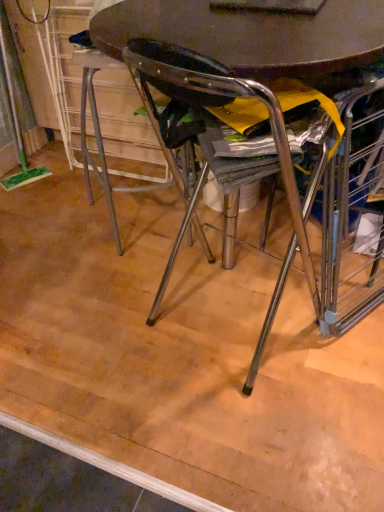
What is the approximate height of metallic brown table at center?

metallic brown table at center is 37.37 inches tall.

Identify the location of metallic brown table at center. (251, 35).

What do you see at coordinates (251, 35) in the screenshot? I see `metallic brown table at center` at bounding box center [251, 35].

This screenshot has width=384, height=512. What do you see at coordinates (180, 359) in the screenshot?
I see `matte wood floor at center` at bounding box center [180, 359].

Find the location of a particular element. matte wood floor at center is located at coordinates (180, 359).

Find the location of `metallic brown table at center`. metallic brown table at center is located at coordinates (251, 35).

Considering the positions of objects metallic brown table at center and matte wood floor at center in the image provided, who is more to the right, metallic brown table at center or matte wood floor at center?

Positioned to the right is metallic brown table at center.

In the image, is metallic brown table at center positioned in front of or behind matte wood floor at center?

Visually, metallic brown table at center is located in front of matte wood floor at center.

Does point (123, 29) come in front of point (246, 337)?

That is True.

Based on the photo, from the image's perspective, is metallic brown table at center on matte wood floor at center?

Indeed, from the image's perspective, metallic brown table at center is shown above matte wood floor at center.

From a real-world perspective, who is located lower, metallic brown table at center or matte wood floor at center?

matte wood floor at center is physically lower.

Which object is wider, metallic brown table at center or matte wood floor at center?

With larger width is matte wood floor at center.

Which of these two, metallic brown table at center or matte wood floor at center, stands taller?

metallic brown table at center is taller.

Considering the relative sizes of metallic brown table at center and matte wood floor at center in the image provided, is metallic brown table at center bigger than matte wood floor at center?

Yes, metallic brown table at center is bigger than matte wood floor at center.

Consider the image. Would you say metallic brown table at center is outside matte wood floor at center?

Yes, metallic brown table at center is located beyond the bounds of matte wood floor at center.

Is metallic brown table at center positioned far away from matte wood floor at center?

No, metallic brown table at center is in close proximity to matte wood floor at center.

Is metallic brown table at center facing towards matte wood floor at center?

No, metallic brown table at center is not facing towards matte wood floor at center.

Measure the distance from metallic brown table at center to matte wood floor at center.

metallic brown table at center is 35.10 inches from matte wood floor at center.

Find the location of a particular element. The width and height of the screenshot is (384, 512). plywood that is below the metallic brown table at center (from the image's perspective) is located at coordinates (180, 359).

Does matte wood floor at center appear on the right side of metallic brown table at center?

Incorrect, matte wood floor at center is not on the right side of metallic brown table at center.

Relative to metallic brown table at center, is matte wood floor at center in front or behind?

matte wood floor at center is positioned farther from the viewer than metallic brown table at center.

Between point (182, 426) and point (233, 25), which one is positioned in front?

The point (233, 25) is in front.

From the image's perspective, is matte wood floor at center under metallic brown table at center?

Indeed, from the image's perspective, matte wood floor at center is shown beneath metallic brown table at center.

From a real-world perspective, who is located lower, matte wood floor at center or metallic brown table at center?

matte wood floor at center is physically lower.

Does matte wood floor at center have a lesser width compared to metallic brown table at center?

In fact, matte wood floor at center might be wider than metallic brown table at center.

Which of these two, matte wood floor at center or metallic brown table at center, stands shorter?

With less height is matte wood floor at center.

Does matte wood floor at center have a larger size compared to metallic brown table at center?

No, matte wood floor at center is not bigger than metallic brown table at center.

Can we say matte wood floor at center lies outside metallic brown table at center?

That's correct, matte wood floor at center is outside of metallic brown table at center.

Is there a large distance between matte wood floor at center and metallic brown table at center?

No, matte wood floor at center is in close proximity to metallic brown table at center.

Is matte wood floor at center looking in the opposite direction of metallic brown table at center?

No, matte wood floor at center is not facing away from metallic brown table at center.

How many degrees apart are the facing directions of matte wood floor at center and metallic brown table at center?

The facing directions of matte wood floor at center and metallic brown table at center are 163 degrees apart.

Measure the distance between matte wood floor at center and metallic brown table at center.

A distance of 89.17 centimeters exists between matte wood floor at center and metallic brown table at center.

The height and width of the screenshot is (512, 384). Identify the location of plywood lying below the metallic brown table at center (from the image's perspective). (180, 359).

The image size is (384, 512). What are the coordinates of `table located above the matte wood floor at center (from the image's perspective)` in the screenshot? It's located at (251, 35).

What are the coordinates of `table above the matte wood floor at center (from a real-world perspective)` in the screenshot? It's located at (251, 35).